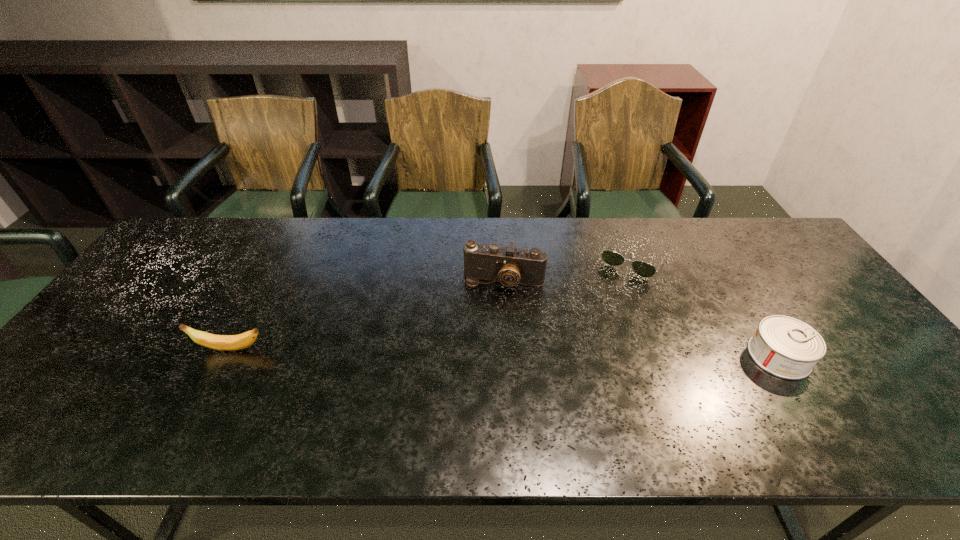
Image resolution: width=960 pixels, height=540 pixels. What are the coordinates of `the third shortest object` in the screenshot? It's located at (217, 342).

Locate an element on the screen. The height and width of the screenshot is (540, 960). banana is located at coordinates (217, 342).

Find the location of `can`. can is located at coordinates (788, 348).

Locate an element on the screen. The image size is (960, 540). the third tallest object is located at coordinates (788, 348).

I want to click on the third object from right to left, so click(510, 266).

You are a GUI agent. You are given a task and a screenshot of the screen. Output one action in this format:
    pyautogui.click(x=<x>, y=<y>)
    Task: Click on the camera
    The width and height of the screenshot is (960, 540).
    Given the screenshot: What is the action you would take?
    pyautogui.click(x=510, y=266)

Identify the location of the second object from right to left. (643, 269).

What are the coordinates of `sunglasses` in the screenshot? It's located at (643, 269).

Image resolution: width=960 pixels, height=540 pixels. I want to click on free region located 0.070m at the stem of the leftmost object, so click(166, 349).

Where is `vacant area situated 0.260m at the stem of the leftmost object`? vacant area situated 0.260m at the stem of the leftmost object is located at coordinates (91, 349).